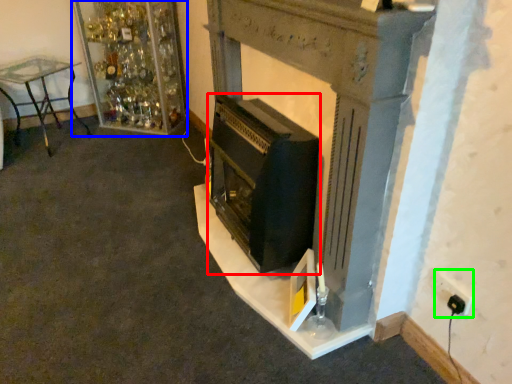
Question: Considering the real-world distances, which object is closest to wood burning stove (highlighted by a red box)? shelf (highlighted by a blue box) or electric outlet (highlighted by a green box).

Choices:
 (A) shelf
 (B) electric outlet

Answer: (B)